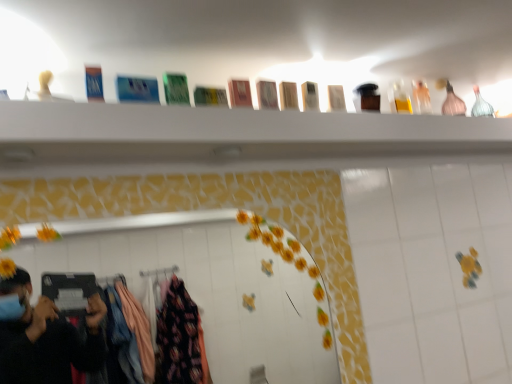
Question: From the image's perspective, is pink glass bottle at upper right located above or below white glossy mirror at center?

Choices:
 (A) above
 (B) below

Answer: (A)

Question: In terms of size, does pink glass bottle at upper right appear bigger or smaller than white glossy mirror at center?

Choices:
 (A) small
 (B) big

Answer: (A)

Question: Which of these objects is positioned closest to the white glossy mirror at center?

Choices:
 (A) pink glass bottle at upper right
 (B) wooden boxes at upper center

Answer: (B)

Question: Which is farther from the white glossy mirror at center?

Choices:
 (A) pink glass bottle at upper right
 (B) wooden boxes at upper center

Answer: (A)